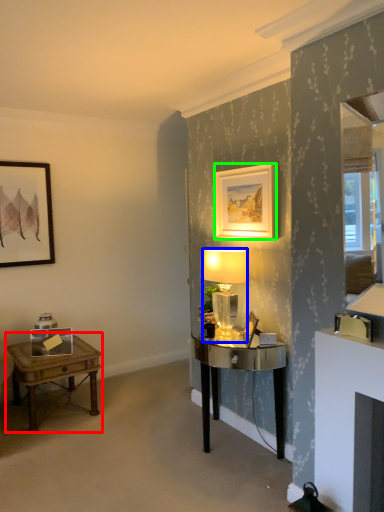
Question: Which object is positioned closest to table (highlighted by a red box)? Select from lamp (highlighted by a blue box) and picture frame (highlighted by a green box).

Choices:
 (A) lamp
 (B) picture frame

Answer: (A)